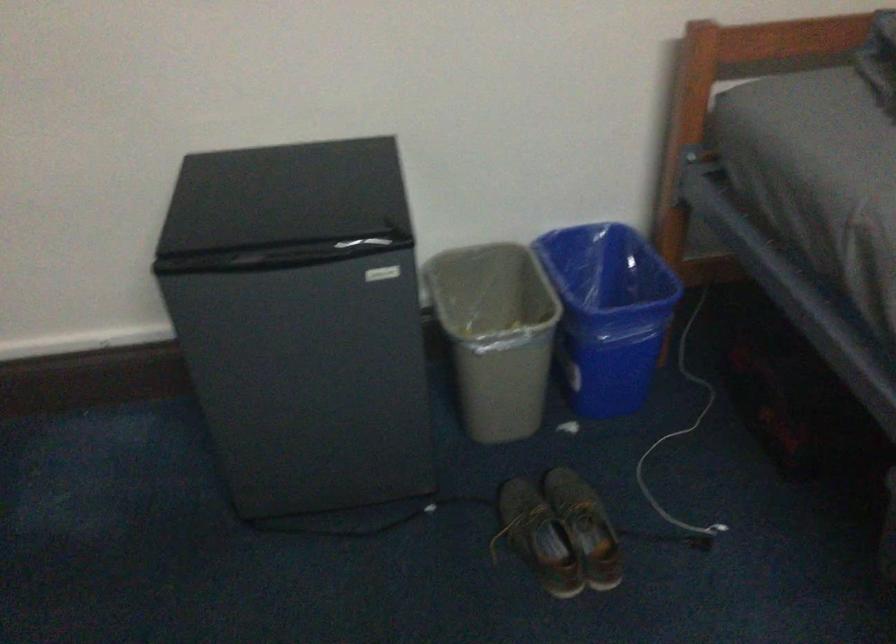
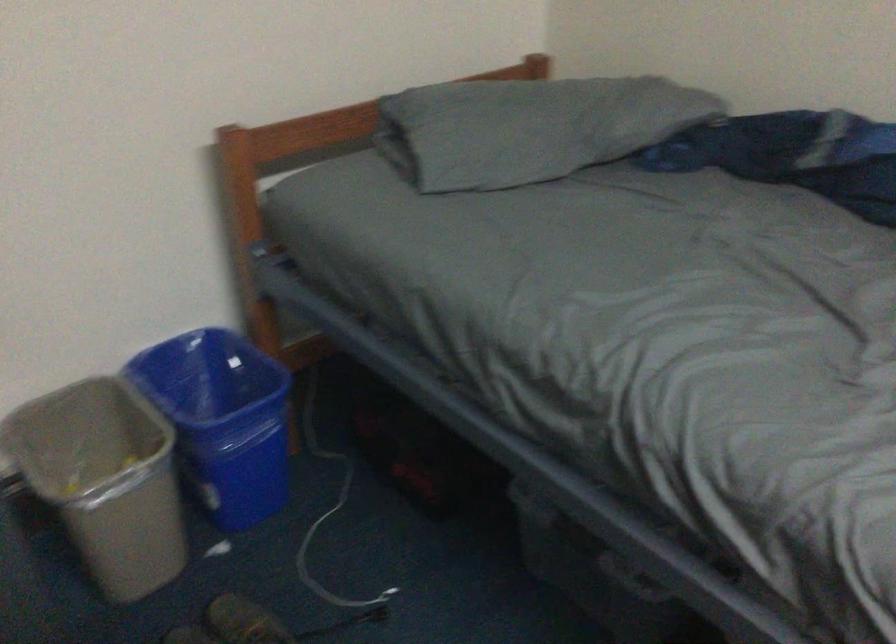
Question: The camera is either moving clockwise (left) or counter-clockwise (right) around the object. The first image is from the beginning of the video and the second image is from the end. Is the camera moving left or right when shooting the video?

Choices:
 (A) Left
 (B) Right

Answer: (A)